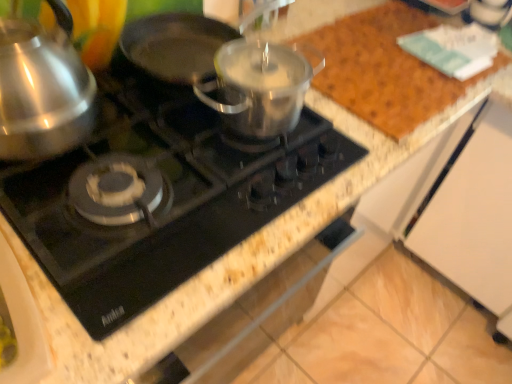
Question: Could you tell me if black glass gas stove at center is facing satin silver kettle at left?

Choices:
 (A) yes
 (B) no

Answer: (B)

Question: Is black glass gas stove at center to the right of satin silver kettle at left from the viewer's perspective?

Choices:
 (A) no
 (B) yes

Answer: (B)

Question: Is black glass gas stove at center far away from satin silver kettle at left?

Choices:
 (A) yes
 (B) no

Answer: (B)

Question: From the image's perspective, is black glass gas stove at center beneath satin silver kettle at left?

Choices:
 (A) no
 (B) yes

Answer: (B)

Question: Are black glass gas stove at center and satin silver kettle at left beside each other?

Choices:
 (A) no
 (B) yes

Answer: (A)

Question: Considering the relative sizes of black glass gas stove at center and satin silver kettle at left in the image provided, is black glass gas stove at center wider than satin silver kettle at left?

Choices:
 (A) yes
 (B) no

Answer: (A)

Question: Can you confirm if satin silver kettle at left is wider than black glass gas stove at center?

Choices:
 (A) yes
 (B) no

Answer: (B)

Question: From the image's perspective, would you say satin silver kettle at left is shown under black glass gas stove at center?

Choices:
 (A) no
 (B) yes

Answer: (A)

Question: Is black glass gas stove at center surrounded by satin silver kettle at left?

Choices:
 (A) no
 (B) yes

Answer: (A)

Question: Is satin silver kettle at left at the left side of black glass gas stove at center?

Choices:
 (A) no
 (B) yes

Answer: (B)

Question: Considering the relative sizes of satin silver kettle at left and black glass gas stove at center in the image provided, is satin silver kettle at left smaller than black glass gas stove at center?

Choices:
 (A) yes
 (B) no

Answer: (A)

Question: Can you confirm if satin silver kettle at left is taller than black glass gas stove at center?

Choices:
 (A) yes
 (B) no

Answer: (A)

Question: In the image, is satin silver kettle at left positioned in front of or behind black glass gas stove at center?

Choices:
 (A) front
 (B) behind

Answer: (A)